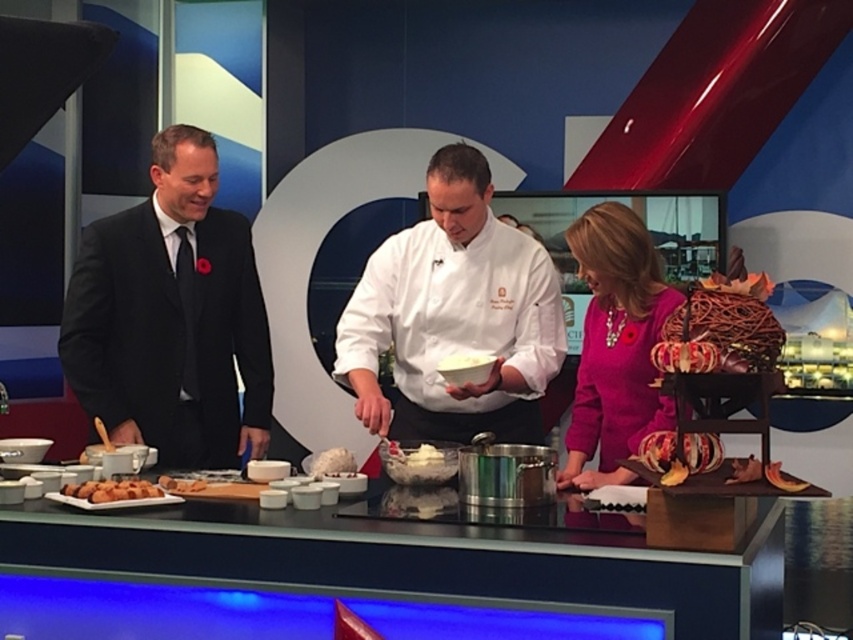
Based on the photo, which of these two, white matte chef coat at center or slightly browned doughnut at center, stands taller?

With more height is white matte chef coat at center.

At what (x,y) coordinates should I click in order to perform the action: click on white matte chef coat at center. Please return your answer as a coordinate pair (x, y). Image resolution: width=853 pixels, height=640 pixels. Looking at the image, I should click on (454, 316).

Measure the distance from purple fabric dress at center to golden crispy pastry at lower left.

purple fabric dress at center is 4.24 feet from golden crispy pastry at lower left.

Which is below, purple fabric dress at center or golden crispy pastry at lower left?

golden crispy pastry at lower left

Between point (662, 292) and point (90, 484), which one is positioned behind?

The point (662, 292) is behind.

I want to click on purple fabric dress at center, so click(614, 346).

Does metallic silver buffet at center appear on the right side of white matte chef coat at center?

Incorrect, metallic silver buffet at center is not on the right side of white matte chef coat at center.

Who is more forward, (189, 524) or (399, 301)?

Point (189, 524) is in front.

Is point (798, 547) closer to camera compared to point (428, 404)?

No, it is behind (428, 404).

This screenshot has width=853, height=640. In order to click on metallic silver buffet at center in this screenshot , I will do `click(473, 560)`.